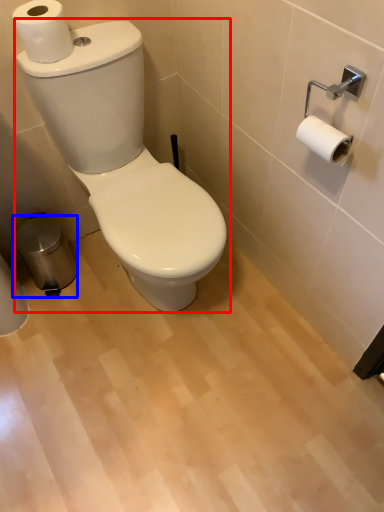
Question: Which object is further to the camera taking this photo, toilet (highlighted by a red box) or trash bin/can (highlighted by a blue box)?

Choices:
 (A) toilet
 (B) trash bin/can

Answer: (B)